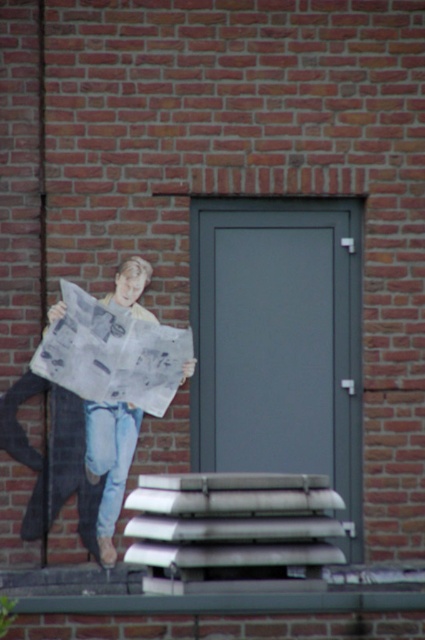
Question: Is white printed newspaper at left below matte newspaper at left?

Choices:
 (A) no
 (B) yes

Answer: (A)

Question: Which object is positioned farthest from the white printed newspaper at left?

Choices:
 (A) denim at left
 (B) matte newspaper at left

Answer: (A)

Question: Considering the real-world distances, which object is closest to the denim at left?

Choices:
 (A) white printed newspaper at left
 (B) matte newspaper at left

Answer: (B)

Question: Which point appears farthest from the camera in this image?

Choices:
 (A) (115, 440)
 (B) (166, 362)

Answer: (A)

Question: Is matte newspaper at left above denim at left?

Choices:
 (A) yes
 (B) no

Answer: (A)

Question: Is white printed newspaper at left above matte newspaper at left?

Choices:
 (A) no
 (B) yes

Answer: (B)